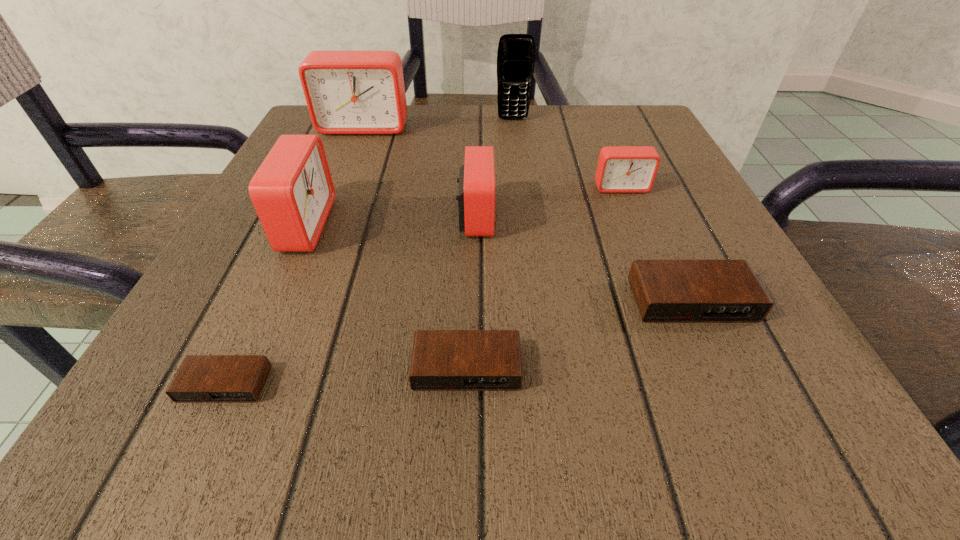
This screenshot has width=960, height=540. I want to click on cellular telephone, so click(516, 52).

Locate an element on the screen. the biggest red alarm clock is located at coordinates (347, 92).

Image resolution: width=960 pixels, height=540 pixels. I want to click on the farthest red alarm clock, so click(x=347, y=92).

Image resolution: width=960 pixels, height=540 pixels. In order to click on the second biggest red alarm clock in this screenshot , I will do `click(292, 192)`.

The width and height of the screenshot is (960, 540). What are the coordinates of `the third tallest object` in the screenshot? It's located at (292, 192).

Image resolution: width=960 pixels, height=540 pixels. I want to click on the fifth shortest object, so click(x=476, y=194).

Identify the location of the third biggest red alarm clock. (476, 194).

Locate an element on the screen. Image resolution: width=960 pixels, height=540 pixels. the sixth nearest alarm clock is located at coordinates (621, 169).

Image resolution: width=960 pixels, height=540 pixels. In order to click on the rightmost red alarm clock in this screenshot , I will do `click(621, 169)`.

I want to click on the third nearest alarm clock, so click(x=666, y=291).